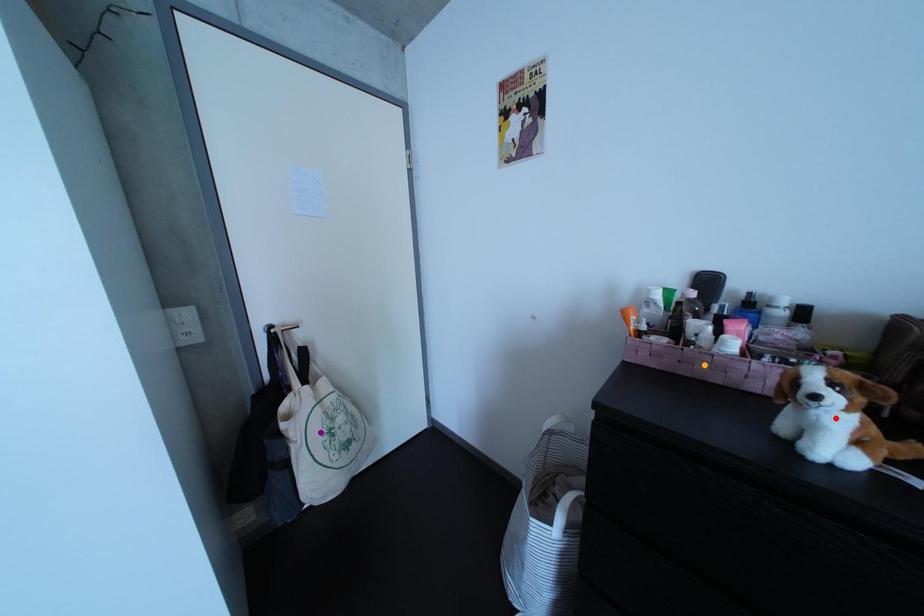
Order these from farthest to nearest:
orange point
purple point
red point

purple point < orange point < red point